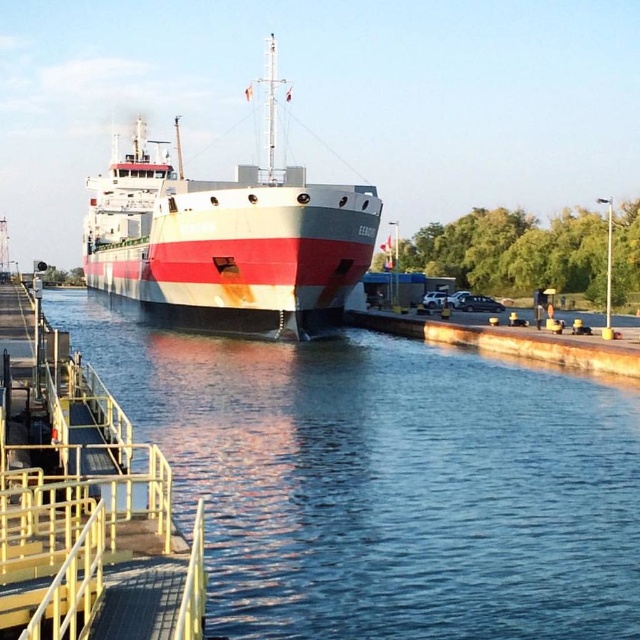
Question: Can you confirm if smooth water at lower center is wider than rustic metal ship at center?

Choices:
 (A) yes
 (B) no

Answer: (B)

Question: Among these points, which one is nearest to the camera?

Choices:
 (A) (93, 240)
 (B) (234, 413)

Answer: (B)

Question: Can you confirm if smooth water at lower center is smaller than rustic metal ship at center?

Choices:
 (A) no
 (B) yes

Answer: (B)

Question: Which object appears farthest from the camera in this image?

Choices:
 (A) rustic metal ship at center
 (B) smooth water at lower center

Answer: (A)

Question: Among these points, which one is nearest to the camera?

Choices:
 (A) (216, 292)
 (B) (429, 582)

Answer: (B)

Question: Can you confirm if smooth water at lower center is positioned to the right of rustic metal ship at center?

Choices:
 (A) yes
 (B) no

Answer: (A)